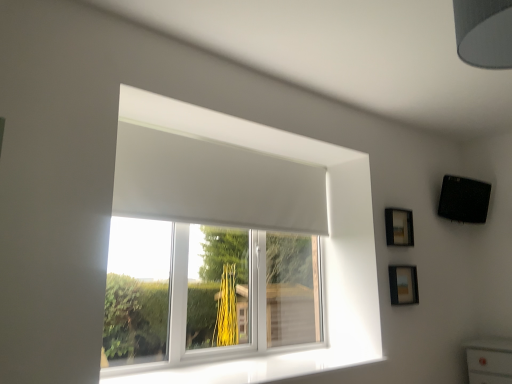
Question: Is white glossy window sill at lower center in front of gray fabric lampshade at upper right?

Choices:
 (A) yes
 (B) no

Answer: (B)

Question: Can you confirm if white glossy window sill at lower center is positioned to the left of gray fabric lampshade at upper right?

Choices:
 (A) no
 (B) yes

Answer: (B)

Question: From the image's perspective, is white glossy window sill at lower center on gray fabric lampshade at upper right?

Choices:
 (A) no
 (B) yes

Answer: (A)

Question: Is white glossy window sill at lower center far from gray fabric lampshade at upper right?

Choices:
 (A) no
 (B) yes

Answer: (B)

Question: Is white glossy window sill at lower center facing towards gray fabric lampshade at upper right?

Choices:
 (A) no
 (B) yes

Answer: (A)

Question: Is white matte window at center spatially inside wooden frame at upper right, acting as the first picture frame starting from the top, or outside of it?

Choices:
 (A) outside
 (B) inside

Answer: (A)

Question: From the image's perspective, is white matte window at center located above or below wooden frame at upper right, the 2th picture frame from the bottom?

Choices:
 (A) above
 (B) below

Answer: (B)

Question: In terms of width, does white matte window at center look wider or thinner when compared to wooden frame at upper right, the 2th picture frame from the bottom?

Choices:
 (A) wide
 (B) thin

Answer: (A)

Question: From a real-world perspective, relative to wooden frame at upper right, the 2th picture frame from the bottom, is white matte window at center vertically above or below?

Choices:
 (A) below
 (B) above

Answer: (A)

Question: In the image, is white matte window at center on the left side or the right side of white glossy window sill at lower center?

Choices:
 (A) left
 (B) right

Answer: (A)

Question: From the image's perspective, is white matte window at center above or below white glossy window sill at lower center?

Choices:
 (A) below
 (B) above

Answer: (B)

Question: Is white matte window at center bigger or smaller than white glossy window sill at lower center?

Choices:
 (A) big
 (B) small

Answer: (A)

Question: In terms of width, does white matte window at center look wider or thinner when compared to white glossy window sill at lower center?

Choices:
 (A) wide
 (B) thin

Answer: (B)

Question: From a real-world perspective, is gray fabric lampshade at upper right physically located above or below white matte window at center?

Choices:
 (A) above
 (B) below

Answer: (A)

Question: From their relative heights in the image, would you say gray fabric lampshade at upper right is taller or shorter than white matte window at center?

Choices:
 (A) short
 (B) tall

Answer: (A)